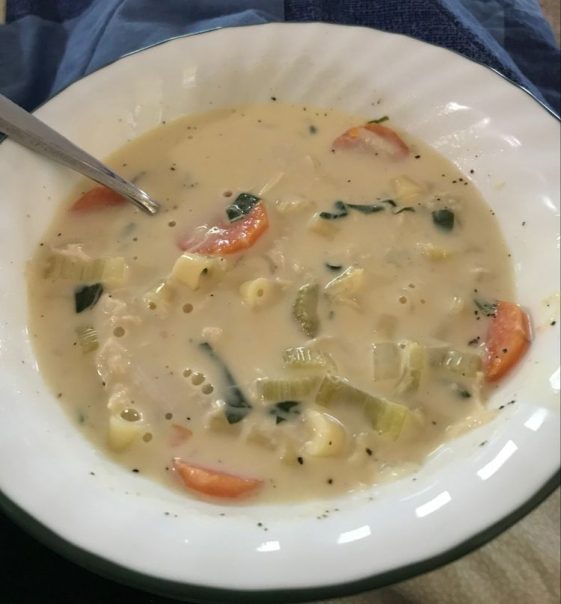
Locate an element on the screen. The width and height of the screenshot is (561, 604). texture on white bowl is located at coordinates pos(338,55).